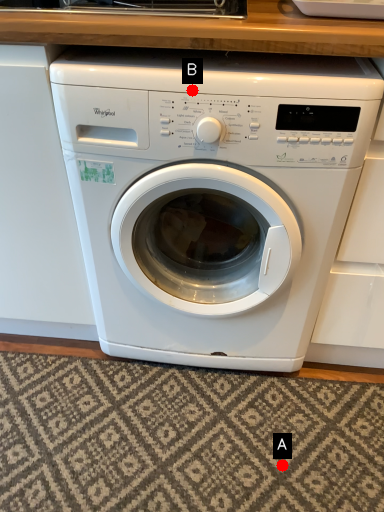
Question: Two points are circled on the image, labeled by A and B beside each circle. Which point is farther to the camera?

Choices:
 (A) A is further
 (B) B is further

Answer: (A)